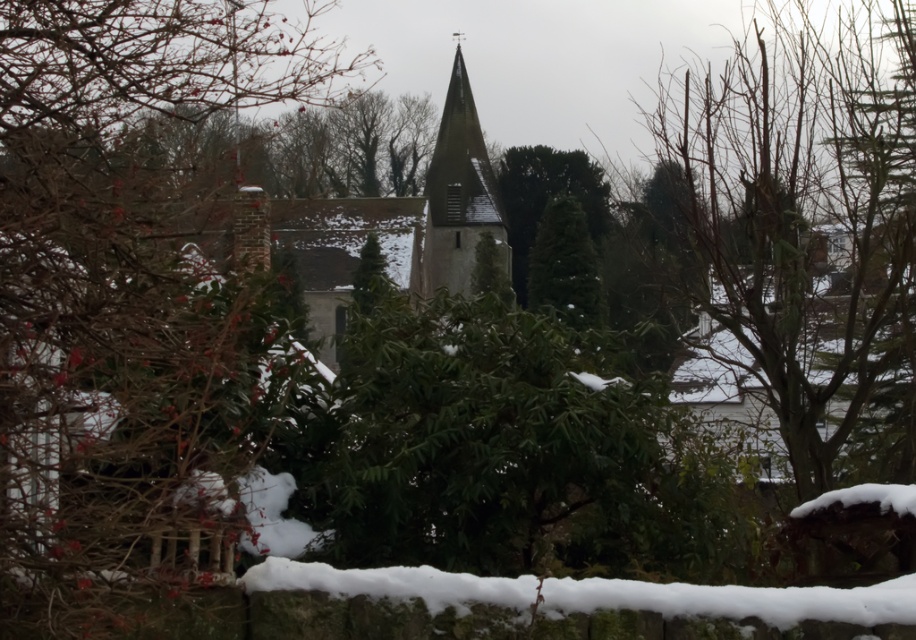
Question: Which of the following is the farthest from the observer?

Choices:
 (A) gray stone tower at center
 (B) green leafy bush at center

Answer: (A)

Question: Is green leafy bush at center to the left of gray stone tower at center from the viewer's perspective?

Choices:
 (A) no
 (B) yes

Answer: (B)

Question: Is green leafy bush at center below gray stone tower at center?

Choices:
 (A) no
 (B) yes

Answer: (B)

Question: Which object is closer to the camera taking this photo?

Choices:
 (A) green leafy bush at center
 (B) gray stone tower at center

Answer: (A)

Question: Is green leafy bush at center above gray stone tower at center?

Choices:
 (A) no
 (B) yes

Answer: (A)